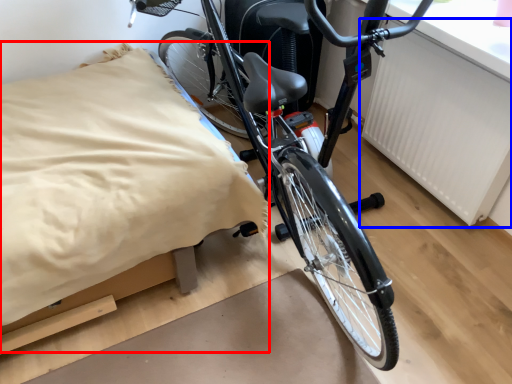
Question: Among these objects, which one is farthest to the camera, sheet (highlighted by a red box) or radiator (highlighted by a blue box)?

Choices:
 (A) sheet
 (B) radiator

Answer: (B)